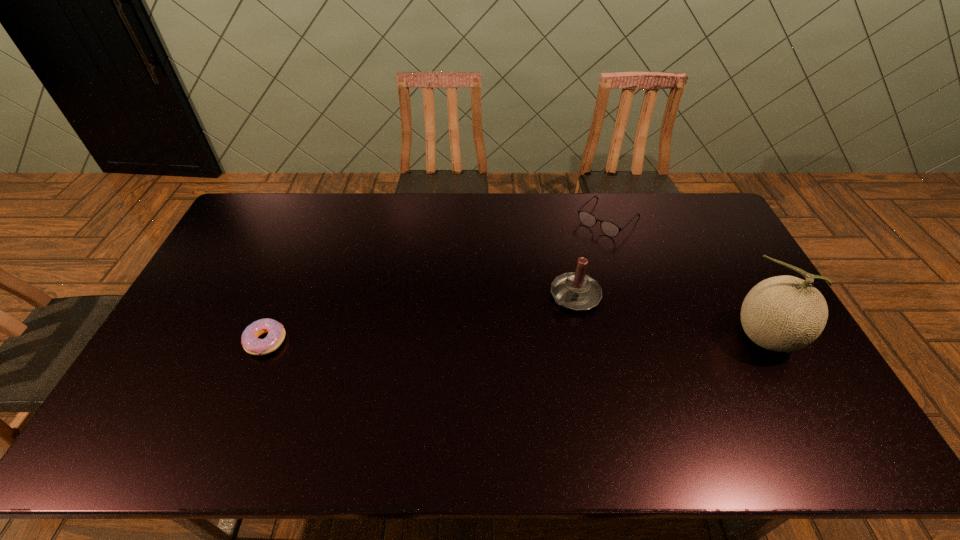
At what (x,y) coordinates should I click in order to perform the action: click on free space at the right edge of the desktop. Please return your answer as a coordinate pair (x, y). This screenshot has height=540, width=960. Looking at the image, I should click on (721, 313).

Identify the location of free space at the near left corner of the desktop. Image resolution: width=960 pixels, height=540 pixels. (191, 386).

Locate an element on the screen. Image resolution: width=960 pixels, height=540 pixels. vacant point located between the shortest object and the farthest object is located at coordinates (437, 280).

Locate an element on the screen. The width and height of the screenshot is (960, 540). free space between the second shortest object and the cantaloup is located at coordinates (687, 278).

This screenshot has width=960, height=540. I want to click on vacant area between the candle and the rightmost object, so click(x=671, y=316).

Identify the location of free area in between the spectacles and the candle. Image resolution: width=960 pixels, height=540 pixels. (591, 257).

The image size is (960, 540). I want to click on free spot between the second tallest object and the doughnut, so click(x=420, y=318).

The image size is (960, 540). What are the coordinates of `free space between the leftmost object and the third shortest object` in the screenshot? It's located at (420, 318).

Find the location of a particular element. The width and height of the screenshot is (960, 540). vacant area between the rightmost object and the doughnut is located at coordinates (516, 339).

Locate an element on the screen. unoccupied area between the leftmost object and the candle is located at coordinates (420, 318).